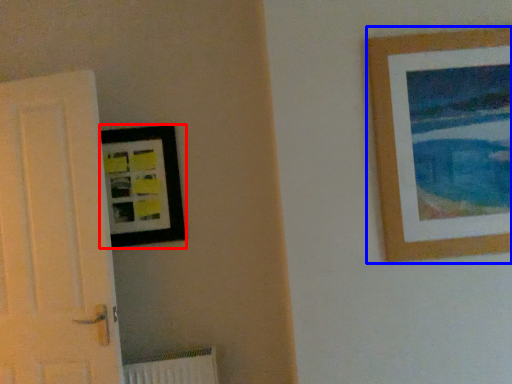
Question: Which point is closer to the camera, picture frame (highlighted by a red box) or picture frame (highlighted by a blue box)?

Choices:
 (A) picture frame
 (B) picture frame

Answer: (B)